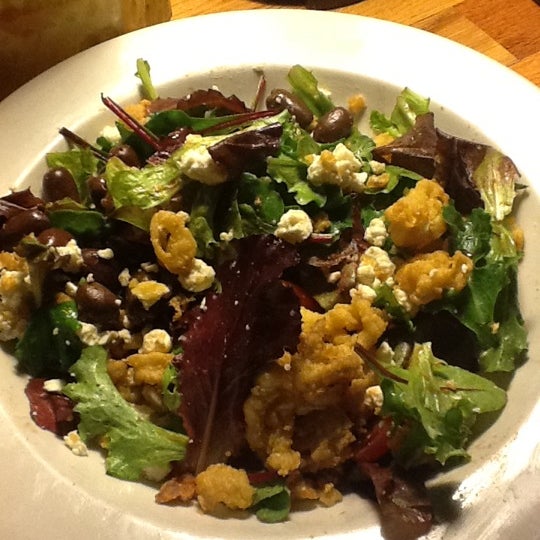
This screenshot has height=540, width=540. What are the coordinates of `table` in the screenshot? It's located at (441, 14).